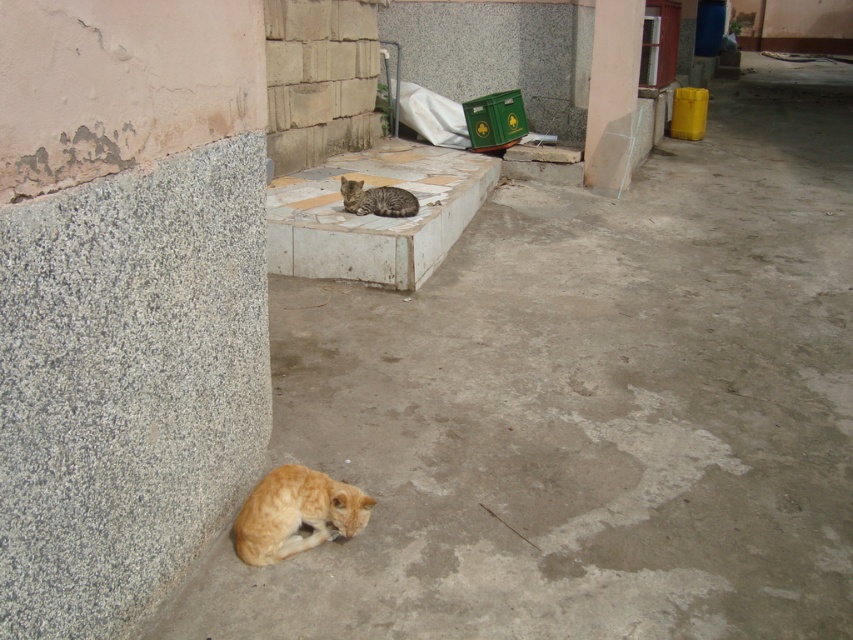
Question: Considering the real-world distances, which object is closest to the orange fur cat at lower left?

Choices:
 (A) striped fur cat at center
 (B) gray stone cat at center
 (C) gray granite pillar at upper center

Answer: (B)

Question: Based on their relative distances, which object is farther from the gray stone cat at center?

Choices:
 (A) gray granite pillar at upper center
 (B) striped fur cat at center
 (C) orange fur cat at lower left

Answer: (C)

Question: Is gray stone cat at center thinner than orange fur cat at lower left?

Choices:
 (A) yes
 (B) no

Answer: (B)

Question: Is gray stone cat at center further to camera compared to orange fur cat at lower left?

Choices:
 (A) yes
 (B) no

Answer: (A)

Question: Is gray granite pillar at upper center positioned behind striped fur cat at center?

Choices:
 (A) no
 (B) yes

Answer: (B)

Question: Among these objects, which one is nearest to the camera?

Choices:
 (A) orange fur cat at lower left
 (B) gray granite pillar at upper center

Answer: (A)